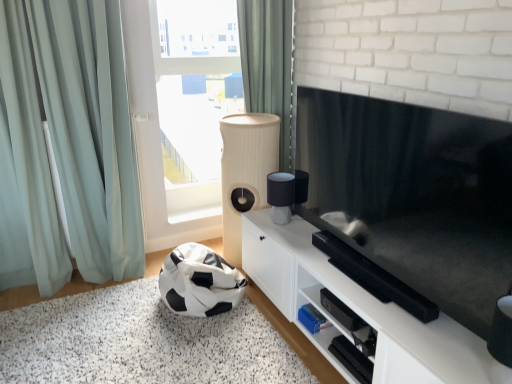
Question: Does point (224, 241) appear closer or farther from the camera than point (199, 375)?

Choices:
 (A) closer
 (B) farther

Answer: (B)

Question: Is beige ribbed speaker at center taller or shorter than black and white fabric bean bag at lower left?

Choices:
 (A) tall
 (B) short

Answer: (A)

Question: Based on their relative distances, which object is farther from the black and white fabric bean bag at lower left?

Choices:
 (A) beige ribbed speaker at center
 (B) light blue fabric curtain at left, positioned as the 1th curtain in left-to-right order
 (C) black and white fabric bean bag at lower left
 (D) green fabric curtain at upper center, which is counted as the first curtain, starting from the right
 (E) transparent glass window at upper center

Answer: (D)

Question: Which object is positioned closest to the white matte cabinet at center?

Choices:
 (A) beige ribbed speaker at center
 (B) black and white fabric bean bag at lower left
 (C) transparent glass window at upper center
 (D) light blue fabric curtain at left, acting as the second curtain starting from the right
 (E) black and white fabric bean bag at lower left

Answer: (E)